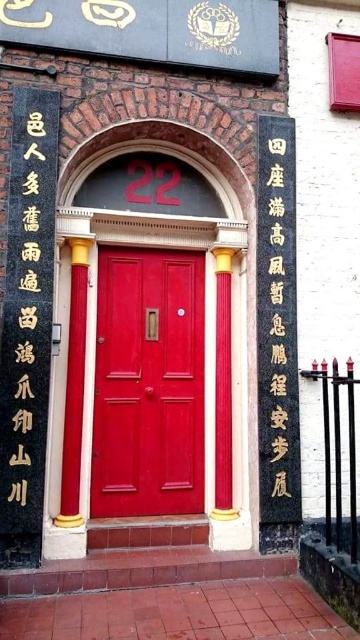
This screenshot has height=640, width=360. What do you see at coordinates (147, 384) in the screenshot?
I see `matte wood door at center` at bounding box center [147, 384].

Does matte wood door at center have a larger size compared to black stone writing at left?

Yes.

Does point (114, 416) come in front of point (29, 445)?

No, it is behind (29, 445).

Find the location of `matte wood door at center`. matte wood door at center is located at coordinates (147, 384).

Describe the element at coordinates (28, 307) in the screenshot. The image size is (360, 640). I see `black stone writing at left` at that location.

Where is `black stone writing at left`? The height and width of the screenshot is (640, 360). black stone writing at left is located at coordinates (28, 307).

Is point (21, 412) farther from viewer compared to point (289, 292)?

No, it is in front of (289, 292).

The image size is (360, 640). Identify the location of black stone writing at left. (28, 307).

Does matte wood door at center have a lesser height compared to black stone writing at center?

Yes.

Who is higher up, matte wood door at center or black stone writing at center?

Positioned higher is black stone writing at center.

Locate an element on the screen. The image size is (360, 640). matte wood door at center is located at coordinates (147, 384).

The height and width of the screenshot is (640, 360). Find the location of `matte wood door at center`. matte wood door at center is located at coordinates (147, 384).